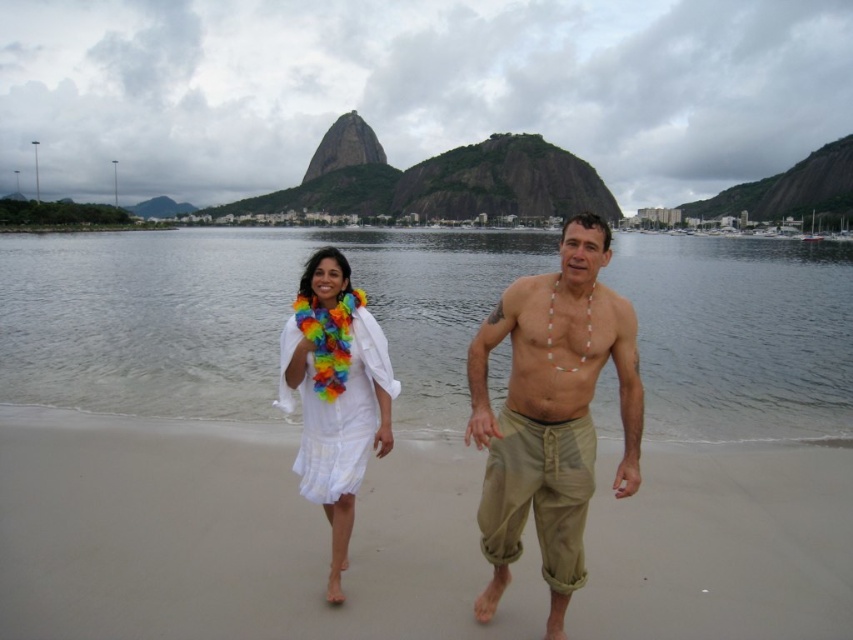
You are a photographer trying to capture the entire scene of the light beige sand at center and the white fabric dress at center in one shot. Based on their widths, which object should you position closer to the camera to ensure both fit in the frame?

The light beige sand at center is wider than the white fabric dress at center. To ensure both fit in the frame, position the light beige sand at center closer to the camera so its width is reduced, allowing both objects to be captured in the shot.

You are a photographer trying to capture a photo of the light beige sand at center and the beige cotton pants at center. You need to know which one is wider in the image. Can you tell me which one is wider?

The light beige sand at center is wider than the beige cotton pants at center.

You are a photographer standing at the edge of the beach. You want to take a photo that includes both the light beige sand at center and the white fabric dress at center. If your camera has a maximum focus range of 20 feet, will you be able to capture both subjects clearly in the same frame?

The light beige sand at center is 19.72 feet away from the white fabric dress at center. Since the distance between them is within the camera maximum focus range of 20 feet, both subjects can be captured clearly in the same frame.